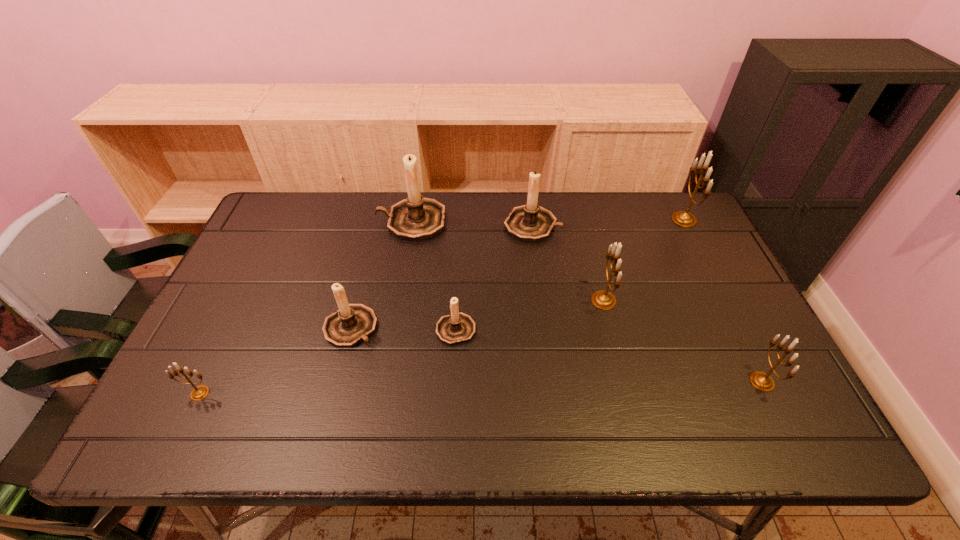
Locate an element on the screen. This screenshot has width=960, height=540. the smallest gold candelabrum is located at coordinates (198, 393).

Find the location of `the leftmost candelabrum`. the leftmost candelabrum is located at coordinates (198, 393).

Where is `vacant space located 0.140m on the front of the biggest brown candle holder`? The image size is (960, 540). vacant space located 0.140m on the front of the biggest brown candle holder is located at coordinates (402, 274).

Locate an element on the screen. vacant point located on the left of the farthest gold candelabrum is located at coordinates (549, 219).

The height and width of the screenshot is (540, 960). I want to click on blank space located 0.100m on the left of the rightmost brown candle holder, so click(x=472, y=225).

Identify the location of vacant space located on the back of the third nearest gold candelabrum. (582, 216).

Find the location of a particular element. free region located 0.160m on the back of the second smallest brown candle holder is located at coordinates (367, 265).

The image size is (960, 540). I want to click on vacant space situated on the left of the third biggest gold candelabrum, so click(x=595, y=382).

At what (x,y) coordinates should I click in order to perform the action: click on vacant space located on the back of the smallest brown candle holder. Please return your answer as a coordinate pair (x, y). Looking at the image, I should click on (458, 275).

Identify the location of vacant space positioned on the back of the leftmost gold candelabrum. The height and width of the screenshot is (540, 960). (229, 333).